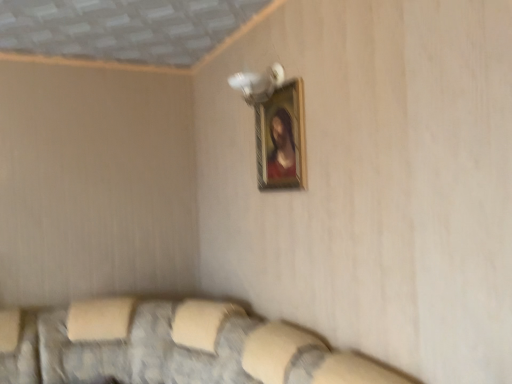
Question: Can you confirm if textured fabric couch at lower center is wider than wooden frame at upper center?

Choices:
 (A) no
 (B) yes

Answer: (B)

Question: Does textured fabric couch at lower center have a lesser height compared to wooden frame at upper center?

Choices:
 (A) no
 (B) yes

Answer: (A)

Question: From the image's perspective, is textured fabric couch at lower center over wooden frame at upper center?

Choices:
 (A) yes
 (B) no

Answer: (B)

Question: Is textured fabric couch at lower center in front of wooden frame at upper center?

Choices:
 (A) no
 (B) yes

Answer: (B)

Question: Is the depth of textured fabric couch at lower center greater than that of wooden frame at upper center?

Choices:
 (A) yes
 (B) no

Answer: (B)

Question: Considering the relative sizes of textured fabric couch at lower center and wooden frame at upper center in the image provided, is textured fabric couch at lower center smaller than wooden frame at upper center?

Choices:
 (A) no
 (B) yes

Answer: (A)

Question: Is wooden frame at upper center positioned far away from textured fabric couch at lower center?

Choices:
 (A) yes
 (B) no

Answer: (A)

Question: Does wooden frame at upper center lie behind textured fabric couch at lower center?

Choices:
 (A) yes
 (B) no

Answer: (A)

Question: From the image's perspective, is wooden frame at upper center beneath textured fabric couch at lower center?

Choices:
 (A) no
 (B) yes

Answer: (A)

Question: Can you confirm if wooden frame at upper center is wider than textured fabric couch at lower center?

Choices:
 (A) yes
 (B) no

Answer: (B)

Question: Could you tell me if wooden frame at upper center is facing textured fabric couch at lower center?

Choices:
 (A) no
 (B) yes

Answer: (A)

Question: Does wooden frame at upper center have a lesser height compared to textured fabric couch at lower center?

Choices:
 (A) no
 (B) yes

Answer: (B)

Question: From a real-world perspective, is textured fabric couch at lower center positioned above or below wooden frame at upper center?

Choices:
 (A) below
 (B) above

Answer: (A)